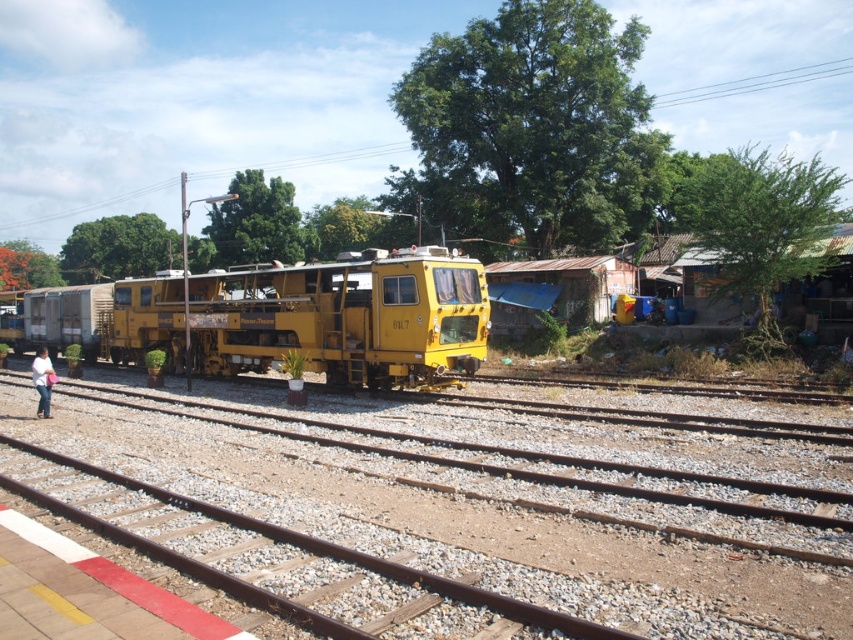
Does yellow matte train at center appear under light blue jeans at lower left?

No, yellow matte train at center is not below light blue jeans at lower left.

Who is more forward, (100, 316) or (48, 394)?

Point (48, 394) is more forward.

Which is in front, point (402, 304) or point (38, 410)?

Point (38, 410) is in front.

Locate an element on the screen. yellow matte train at center is located at coordinates (311, 317).

Does brown gravel train track at center have a larger size compared to yellow matte train at center?

No.

Is point (660, 605) positioned before point (427, 356)?

Yes, point (660, 605) is in front of point (427, 356).

Where is `brown gravel train track at center`? brown gravel train track at center is located at coordinates (479, 524).

Can you confirm if brown gravel train track at center is positioned above light blue jeans at lower left?

Actually, brown gravel train track at center is below light blue jeans at lower left.

Between brown gravel train track at center and light blue jeans at lower left, which one has more height?

light blue jeans at lower left

This screenshot has width=853, height=640. What are the coordinates of `brown gravel train track at center` in the screenshot? It's located at (479, 524).

Locate an element on the screen. This screenshot has width=853, height=640. brown gravel train track at center is located at coordinates (479, 524).